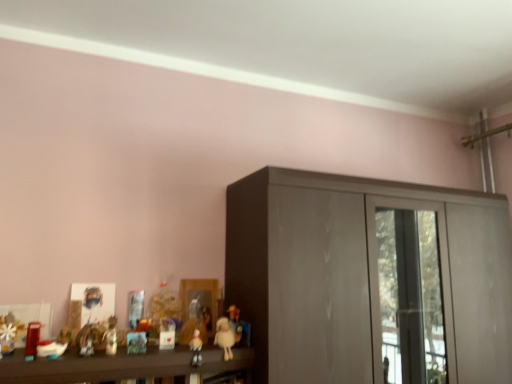
This screenshot has width=512, height=384. Describe the element at coordinates (370, 279) in the screenshot. I see `glossy wood cupboard at center` at that location.

Identify the location of matte plastic toy at lower left, the sixth toy from the right. (32, 340).

Find the location of a particular element. white matte snowflake at left, which is the 7th toy in right-to-left order is located at coordinates (9, 332).

In order to click on white matte figurine at center, acting as the fourth toy starting from the right in this screenshot , I will do `click(167, 334)`.

What do you see at coordinates (239, 326) in the screenshot? I see `matte yellow plush at center, which appears as the 7th toy when viewed from the left` at bounding box center [239, 326].

Find the location of `glossy wood cupboard at center`. glossy wood cupboard at center is located at coordinates (370, 279).

In the scene shown: How distant is matte plastic toy at lower left, which is the fifth toy from right to left, from fluffy white teddy bear at lower center, marked as the 2th toy in a right-to-left arrangement?

A distance of 12.29 inches exists between matte plastic toy at lower left, which is the fifth toy from right to left, and fluffy white teddy bear at lower center, marked as the 2th toy in a right-to-left arrangement.

Considering the positions of objects matte plastic toy at lower left, the 3th toy viewed from the left, and fluffy white teddy bear at lower center, marked as the 2th toy in a right-to-left arrangement, in the image provided, who is in front, matte plastic toy at lower left, the 3th toy viewed from the left, or fluffy white teddy bear at lower center, marked as the 2th toy in a right-to-left arrangement,?

matte plastic toy at lower left, the 3th toy viewed from the left, is in front.

I want to click on toy that is the 3rd one when counting rightward from the matte plastic toy at lower left, which is the fifth toy from right to left, so click(225, 337).

Is matte plastic toy at lower left, which is the fifth toy from right to left, spatially inside fluffy white teddy bear at lower center, which is the 6th toy in left-to-right order, or outside of it?

matte plastic toy at lower left, which is the fifth toy from right to left, is spatially situated outside fluffy white teddy bear at lower center, which is the 6th toy in left-to-right order.

Looking at this image, does matte plastic doll at center, which is the 3th toy from right to left, have a lesser height compared to matte plastic toy at lower left, the 3th toy viewed from the left?

Correct, matte plastic doll at center, which is the 3th toy from right to left, is not as tall as matte plastic toy at lower left, the 3th toy viewed from the left.

Is matte plastic doll at center, which is the 3th toy from right to left, spatially inside matte plastic toy at lower left, the 3th toy viewed from the left, or outside of it?

The correct answer is: outside.

Considering the relative sizes of matte plastic doll at center, which is the 3th toy from right to left, and matte plastic toy at lower left, which is the fifth toy from right to left, in the image provided, is matte plastic doll at center, which is the 3th toy from right to left, smaller than matte plastic toy at lower left, which is the fifth toy from right to left,?

No.

How far apart are fluffy white teddy bear at lower center, which is the 6th toy in left-to-right order, and matte plastic toy at lower left, the 3th toy viewed from the left?

12.29 inches.

From the image's perspective, would you say fluffy white teddy bear at lower center, marked as the 2th toy in a right-to-left arrangement, is shown under matte plastic toy at lower left, the 3th toy viewed from the left?

Indeed, from the image's perspective, fluffy white teddy bear at lower center, marked as the 2th toy in a right-to-left arrangement, is shown beneath matte plastic toy at lower left, the 3th toy viewed from the left.

Which is behind, point (224, 343) or point (115, 320)?

The point (115, 320) is more distant.

Can you confirm if fluffy white teddy bear at lower center, which is the 6th toy in left-to-right order, is positioned to the left of matte plastic toy at lower left, the 3th toy viewed from the left?

No, fluffy white teddy bear at lower center, which is the 6th toy in left-to-right order, is not to the left of matte plastic toy at lower left, the 3th toy viewed from the left.

From the image's perspective, which one is positioned higher, matte yellow plush at center, marked as the first toy in a right-to-left arrangement, or matte plastic toy at lower left, the second toy positioned from the left?

matte plastic toy at lower left, the second toy positioned from the left.

How many degrees apart are the facing directions of matte yellow plush at center, which appears as the 7th toy when viewed from the left, and matte plastic toy at lower left, the sixth toy from the right?

There is a 10.1-degree angle between the facing directions of matte yellow plush at center, which appears as the 7th toy when viewed from the left, and matte plastic toy at lower left, the sixth toy from the right.

Does matte yellow plush at center, marked as the first toy in a right-to-left arrangement, lie in front of matte plastic toy at lower left, the sixth toy from the right?

No, matte yellow plush at center, marked as the first toy in a right-to-left arrangement, is further to the viewer.

Between matte yellow plush at center, which appears as the 7th toy when viewed from the left, and matte plastic toy at lower left, the sixth toy from the right, which one has more height?

Standing taller between the two is matte yellow plush at center, which appears as the 7th toy when viewed from the left.

From a real-world perspective, who is located lower, matte plastic doll at center, positioned as the fifth toy in left-to-right order, or matte plastic toy at lower left, the sixth toy from the right?

matte plastic doll at center, positioned as the fifth toy in left-to-right order, is physically lower.

Does matte plastic doll at center, positioned as the fifth toy in left-to-right order, have a larger size compared to matte plastic toy at lower left, the sixth toy from the right?

Correct, matte plastic doll at center, positioned as the fifth toy in left-to-right order, is larger in size than matte plastic toy at lower left, the sixth toy from the right.

Which object is further away from the camera taking this photo, matte plastic doll at center, which is the 3th toy from right to left, or matte plastic toy at lower left, the sixth toy from the right?

matte plastic doll at center, which is the 3th toy from right to left, is more distant.

From the image's perspective, is matte plastic doll at center, which is the 3th toy from right to left, located beneath matte plastic toy at lower left, the sixth toy from the right?

Yes, from the image's perspective, matte plastic doll at center, which is the 3th toy from right to left, is below matte plastic toy at lower left, the sixth toy from the right.

How many degrees apart are the facing directions of matte plastic toy at lower left, which is the fifth toy from right to left, and matte plastic toy at lower left, the second toy positioned from the left?

matte plastic toy at lower left, which is the fifth toy from right to left, and matte plastic toy at lower left, the second toy positioned from the left, are facing 8.85 degrees away from each other.

Is matte plastic toy at lower left, the 3th toy viewed from the left, in front of matte plastic toy at lower left, the second toy positioned from the left?

No, matte plastic toy at lower left, the 3th toy viewed from the left, is behind matte plastic toy at lower left, the second toy positioned from the left.

Does matte plastic toy at lower left, the 3th toy viewed from the left, touch matte plastic toy at lower left, the second toy positioned from the left?

A: No, matte plastic toy at lower left, the 3th toy viewed from the left, is not in contact with matte plastic toy at lower left, the second toy positioned from the left.

Which of these two, matte plastic toy at lower left, the 3th toy viewed from the left, or matte plastic toy at lower left, the second toy positioned from the left, is wider?

matte plastic toy at lower left, the second toy positioned from the left, is wider.

Based on the photo, would you say white matte snowflake at left, which is the 7th toy in right-to-left order, is inside or outside matte yellow plush at center, marked as the first toy in a right-to-left arrangement?

white matte snowflake at left, which is the 7th toy in right-to-left order, cannot be found inside matte yellow plush at center, marked as the first toy in a right-to-left arrangement.

Locate an element on the screen. This screenshot has width=512, height=384. toy located above the white matte snowflake at left, positioned as the first toy in left-to-right order (from a real-world perspective) is located at coordinates pyautogui.click(x=239, y=326).

Which is more to the left, white matte snowflake at left, positioned as the first toy in left-to-right order, or matte yellow plush at center, which appears as the 7th toy when viewed from the left?

white matte snowflake at left, positioned as the first toy in left-to-right order.

Does point (21, 328) come behind point (227, 313)?

No, it is not.

Identify the location of the 3rd toy in front when counting from the fluffy white teddy bear at lower center, which is the 6th toy in left-to-right order. This screenshot has width=512, height=384. (111, 336).

This screenshot has height=384, width=512. I want to click on the 2nd toy behind the matte plastic toy at lower left, which is the fifth toy from right to left, so click(x=196, y=348).

Based on their spatial positions, is matte yellow plush at center, marked as the first toy in a right-to-left arrangement, or matte plastic toy at lower left, the 3th toy viewed from the left, closer to glossy wood cupboard at center?

Based on the image, matte yellow plush at center, marked as the first toy in a right-to-left arrangement, appears to be nearer to glossy wood cupboard at center.

From the image, which object appears to be nearer to white matte snowflake at left, positioned as the first toy in left-to-right order, fluffy white teddy bear at lower center, marked as the 2th toy in a right-to-left arrangement, or matte plastic toy at lower left, the sixth toy from the right?

The object closer to white matte snowflake at left, positioned as the first toy in left-to-right order, is matte plastic toy at lower left, the sixth toy from the right.

Based on their spatial positions, is white matte snowflake at left, which is the 7th toy in right-to-left order, or matte plastic toy at lower left, the sixth toy from the right, further from matte yellow plush at center, which appears as the 7th toy when viewed from the left?

The object further to matte yellow plush at center, which appears as the 7th toy when viewed from the left, is white matte snowflake at left, which is the 7th toy in right-to-left order.

Which object lies nearer to the anchor point glossy wood cupboard at center, matte yellow plush at center, which appears as the 7th toy when viewed from the left, or white matte snowflake at left, which is the 7th toy in right-to-left order?

The object closer to glossy wood cupboard at center is matte yellow plush at center, which appears as the 7th toy when viewed from the left.

When comparing their distances from matte yellow plush at center, which appears as the 7th toy when viewed from the left, does glossy wood cupboard at center or fluffy white teddy bear at lower center, marked as the 2th toy in a right-to-left arrangement, seem closer?

fluffy white teddy bear at lower center, marked as the 2th toy in a right-to-left arrangement, is closer to matte yellow plush at center, which appears as the 7th toy when viewed from the left.

Based on their spatial positions, is matte plastic doll at center, which is the 3th toy from right to left, or white matte figurine at center, acting as the fourth toy starting from the right, closer to matte yellow plush at center, which appears as the 7th toy when viewed from the left?

Based on the image, matte plastic doll at center, which is the 3th toy from right to left, appears to be nearer to matte yellow plush at center, which appears as the 7th toy when viewed from the left.

Based on their spatial positions, is matte plastic toy at lower left, which is the fifth toy from right to left, or matte plastic doll at center, positioned as the fifth toy in left-to-right order, further from white matte figurine at center, acting as the fourth toy starting from the right?

matte plastic toy at lower left, which is the fifth toy from right to left.

When comparing their distances from matte plastic toy at lower left, the 3th toy viewed from the left, does matte plastic doll at center, positioned as the fifth toy in left-to-right order, or glossy wood cupboard at center seem closer?

Among the two, matte plastic doll at center, positioned as the fifth toy in left-to-right order, is located nearer to matte plastic toy at lower left, the 3th toy viewed from the left.

Where is `toy between matte plastic toy at lower left, the 3th toy viewed from the left, and matte plastic doll at center, which is the 3th toy from right to left, from left to right`? This screenshot has width=512, height=384. toy between matte plastic toy at lower left, the 3th toy viewed from the left, and matte plastic doll at center, which is the 3th toy from right to left, from left to right is located at coordinates (167, 334).

Identify the location of toy between matte plastic toy at lower left, the sixth toy from the right, and white matte figurine at center, positioned as the fourth toy in left-to-right order, from left to right. (111, 336).

Where is `toy situated between white matte figurine at center, acting as the fourth toy starting from the right, and fluffy white teddy bear at lower center, which is the 6th toy in left-to-right order, from left to right`? Image resolution: width=512 pixels, height=384 pixels. toy situated between white matte figurine at center, acting as the fourth toy starting from the right, and fluffy white teddy bear at lower center, which is the 6th toy in left-to-right order, from left to right is located at coordinates tap(196, 348).

Locate an element on the screen. The width and height of the screenshot is (512, 384). toy between fluffy white teddy bear at lower center, marked as the 2th toy in a right-to-left arrangement, and glossy wood cupboard at center from left to right is located at coordinates (239, 326).